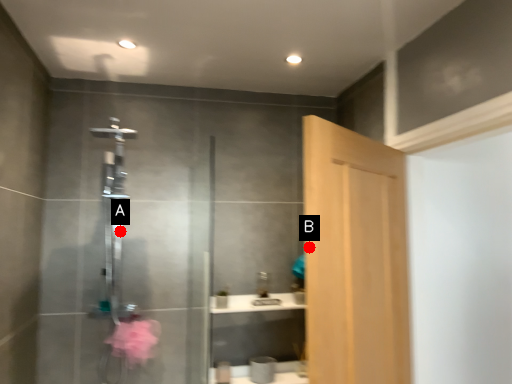
Question: Two points are circled on the image, labeled by A and B beside each circle. Which point is closer to the camera?

Choices:
 (A) A is closer
 (B) B is closer

Answer: (B)